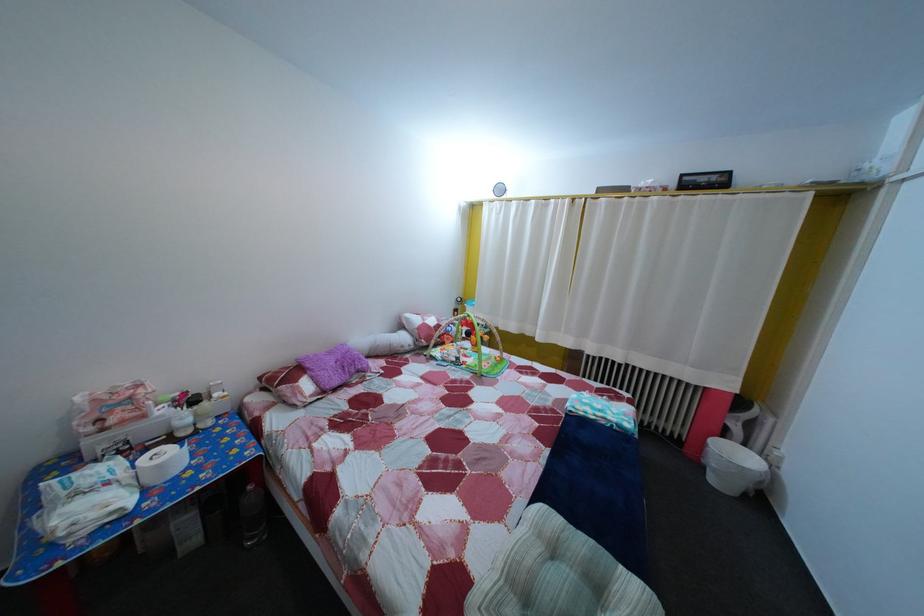
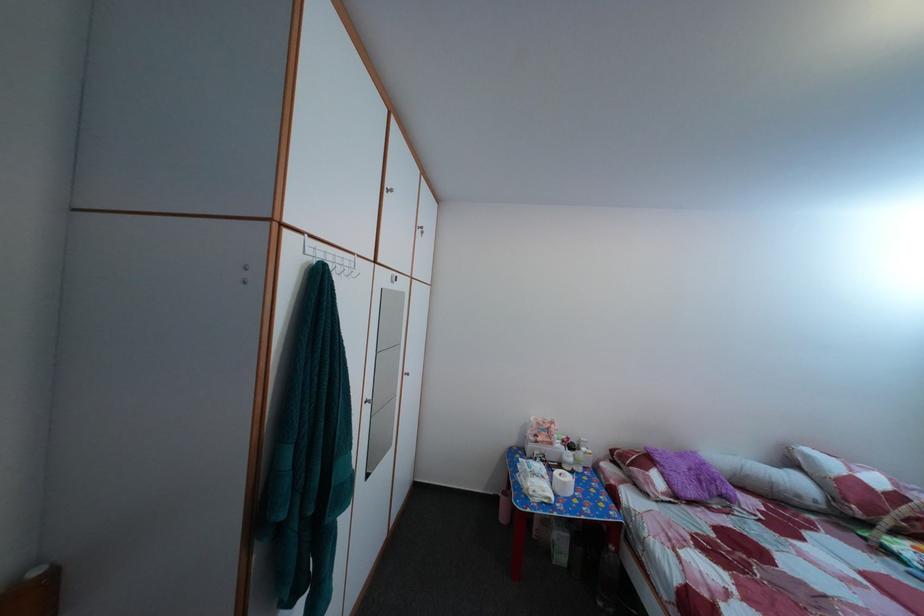
Find the pixel in the second image that matches the point at 103,523 in the first image.

(551, 500)